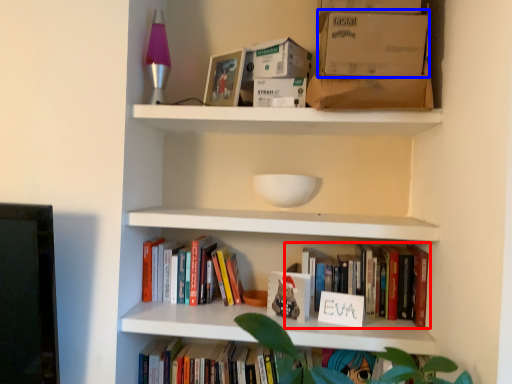
Question: Which of the following is the farthest to the observer, book (highlighted by a red box) or cardboard box (highlighted by a blue box)?

Choices:
 (A) book
 (B) cardboard box

Answer: (A)